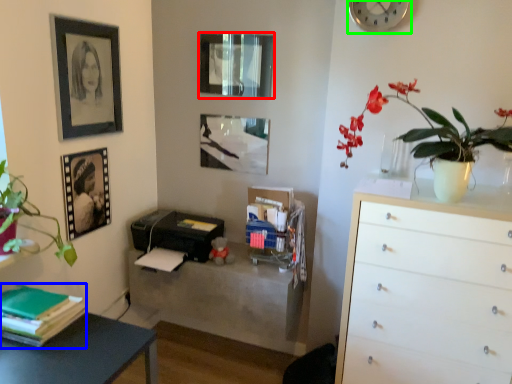
Question: Which is nearer to the picture frame (highlighted by a red box)? book (highlighted by a blue box) or clock (highlighted by a green box).

Choices:
 (A) book
 (B) clock

Answer: (B)